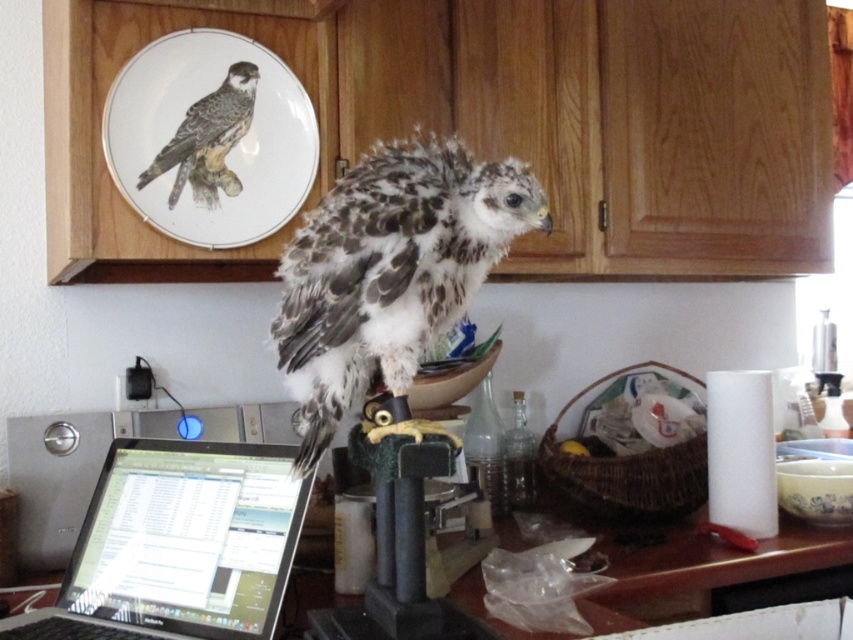
You are a visitor in the kitchen and want to take a photo of the speckled feathered falcon at center without any background distractions. Since the white porcelain plate at upper center is behind it, will the falcon block the plate from your view?

Yes, the speckled feathered falcon at center is in front of the white porcelain plate at upper center, so it will block the plate from view when taking the photo.

In the kitchen scene, there is a speckled feathered falcon at center and a white porcelain plate at upper center. From the perspective of someone standing in front of the scene, which object is positioned to the left?

The white porcelain plate at upper center is positioned to the left of the speckled feathered falcon at center.

You are organizing items in the kitchen and need to place the black glossy laptop at lower left and the dark gray feathers at upper left on a shelf. Which item requires more horizontal space?

The black glossy laptop at lower left requires more horizontal space because its width is larger than the dark gray feathers at upper left.